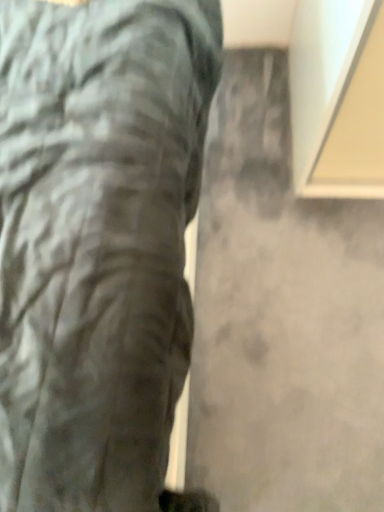
The width and height of the screenshot is (384, 512). I want to click on matte gray trousers at center, so click(x=97, y=243).

Describe the element at coordinates (97, 243) in the screenshot. Image resolution: width=384 pixels, height=512 pixels. I see `matte gray trousers at center` at that location.

The width and height of the screenshot is (384, 512). What do you see at coordinates (282, 317) in the screenshot?
I see `gray matte concrete at center` at bounding box center [282, 317].

Locate an element on the screen. This screenshot has width=384, height=512. gray matte concrete at center is located at coordinates (282, 317).

This screenshot has width=384, height=512. Identify the location of matte gray trousers at center. (97, 243).

Which is more to the left, matte gray trousers at center or gray matte concrete at center?

Positioned to the left is matte gray trousers at center.

Which object is closer to the camera, matte gray trousers at center or gray matte concrete at center?

matte gray trousers at center is in front.

Which is farther from the camera, (108, 480) or (338, 399)?

Positioned behind is point (338, 399).

From the image's perspective, is matte gray trousers at center above gray matte concrete at center?

Correct, matte gray trousers at center appears higher than gray matte concrete at center in the image.

From a real-world perspective, is matte gray trousers at center over gray matte concrete at center?

Yes, from a real-world perspective, matte gray trousers at center is over gray matte concrete at center

Considering the sizes of objects matte gray trousers at center and gray matte concrete at center in the image provided, who is thinner, matte gray trousers at center or gray matte concrete at center?

gray matte concrete at center is thinner.

Which of these two, matte gray trousers at center or gray matte concrete at center, stands shorter?

Standing shorter between the two is gray matte concrete at center.

Consider the image. Is matte gray trousers at center bigger than gray matte concrete at center?

Yes, matte gray trousers at center is bigger than gray matte concrete at center.

Is matte gray trousers at center not inside gray matte concrete at center?

matte gray trousers at center lies outside gray matte concrete at center's area.

Is matte gray trousers at center far away from gray matte concrete at center?

No, matte gray trousers at center is not far from gray matte concrete at center.

Is matte gray trousers at center positioned with its back to gray matte concrete at center?

No.

How far apart are matte gray trousers at center and gray matte concrete at center?

matte gray trousers at center is 55.92 centimeters from gray matte concrete at center.

Find the location of a particular element. trousers on the left of the gray matte concrete at center is located at coordinates (97, 243).

Visually, is gray matte concrete at center positioned to the left or to the right of matte gray trousers at center?

From the image, it's evident that gray matte concrete at center is to the right of matte gray trousers at center.

Looking at this image, which is behind, gray matte concrete at center or matte gray trousers at center?

gray matte concrete at center.

Does point (261, 431) lie behind point (0, 32)?

Yes, it is.

From the image's perspective, which object appears higher, gray matte concrete at center or matte gray trousers at center?

matte gray trousers at center is shown above in the image.

From a real-world perspective, does gray matte concrete at center stand above matte gray trousers at center?

No, from a real-world perspective, gray matte concrete at center is not on top of matte gray trousers at center.

Which object is wider, gray matte concrete at center or matte gray trousers at center?

With larger width is matte gray trousers at center.

Between gray matte concrete at center and matte gray trousers at center, which one has less height?

gray matte concrete at center.

Considering the sizes of objects gray matte concrete at center and matte gray trousers at center in the image provided, who is smaller, gray matte concrete at center or matte gray trousers at center?

With smaller size is gray matte concrete at center.

Is gray matte concrete at center outside of matte gray trousers at center?

Yes.

Is gray matte concrete at center far from matte gray trousers at center?

gray matte concrete at center is actually quite close to matte gray trousers at center.

Is gray matte concrete at center aimed at matte gray trousers at center?

No, gray matte concrete at center is not aimed at matte gray trousers at center.

How different are the orientations of gray matte concrete at center and matte gray trousers at center in degrees?

0.0467 degrees.

Find the location of a particular element. The height and width of the screenshot is (512, 384). concrete behind the matte gray trousers at center is located at coordinates coord(282,317).

The width and height of the screenshot is (384, 512). In order to click on trousers lying on the left of gray matte concrete at center in this screenshot , I will do `click(97, 243)`.

Locate an element on the screen. The width and height of the screenshot is (384, 512). concrete below the matte gray trousers at center (from the image's perspective) is located at coordinates (282, 317).